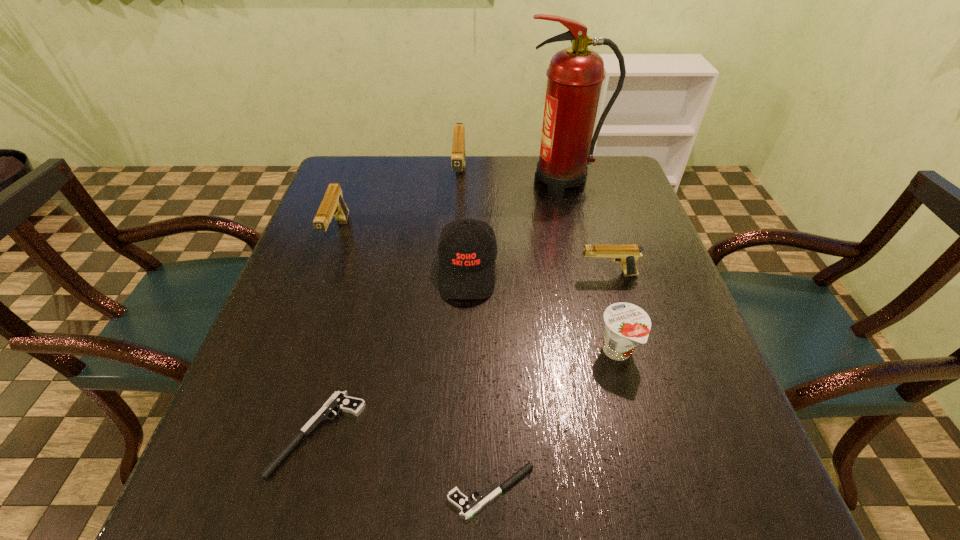
You are a GUI agent. You are given a task and a screenshot of the screen. Output one action in this format:
    pyautogui.click(x=<x>, y=<y>)
    Task: Click on the tallest object
    The height and width of the screenshot is (540, 960).
    Given the screenshot: What is the action you would take?
    pyautogui.click(x=575, y=75)

Image resolution: width=960 pixels, height=540 pixels. Find the location of `fire extinguisher`. fire extinguisher is located at coordinates [575, 75].

This screenshot has height=540, width=960. In order to click on the second tan pistol from left to right in this screenshot , I will do `click(458, 160)`.

Where is `the biggest tan pistol`? the biggest tan pistol is located at coordinates (458, 160).

The width and height of the screenshot is (960, 540). Identify the location of the leftmost object. (333, 205).

This screenshot has height=540, width=960. What are the coordinates of `the leftmost pistol` in the screenshot? It's located at (333, 205).

Locate an element on the screen. baseball cap is located at coordinates (466, 270).

What are the coordinates of `the sixth farthest object` in the screenshot? It's located at (626, 325).

This screenshot has height=540, width=960. What are the coordinates of `the rightmost pistol` in the screenshot? It's located at (627, 254).

You are a GUI agent. You are given a task and a screenshot of the screen. Output one action in this format:
    pyautogui.click(x=<x>, y=<y>)
    Task: Click on the nearest tan pistol
    
    Given the screenshot: What is the action you would take?
    pyautogui.click(x=627, y=254)